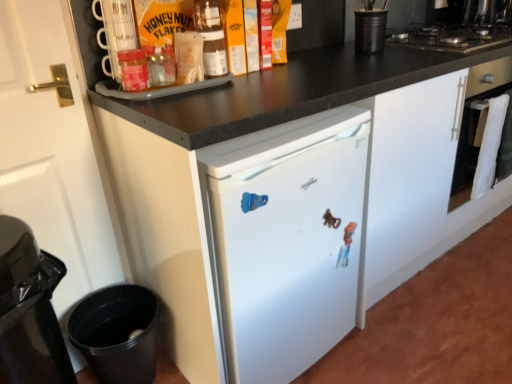
Question: Is matte glass honey jar at upper center, the second bottle positioned from the left, inside white matte door at left?

Choices:
 (A) no
 (B) yes

Answer: (A)

Question: Does white matte door at left have a greater height compared to matte glass honey jar at upper center, which is the first bottle in back-to-front order?

Choices:
 (A) no
 (B) yes

Answer: (B)

Question: From the image's perspective, would you say white matte door at left is shown under matte glass honey jar at upper center, the second bottle positioned from the left?

Choices:
 (A) yes
 (B) no

Answer: (A)

Question: From a real-world perspective, is white matte door at left under matte glass honey jar at upper center, which is counted as the second bottle, starting from the bottom?

Choices:
 (A) yes
 (B) no

Answer: (A)

Question: Is white matte door at left at the left side of matte glass honey jar at upper center, which is counted as the second bottle, starting from the bottom?

Choices:
 (A) no
 (B) yes

Answer: (B)

Question: Is the position of white matte door at left less distant than that of matte glass honey jar at upper center, which ranks as the 1th bottle in top-to-bottom order?

Choices:
 (A) no
 (B) yes

Answer: (B)

Question: From a real-world perspective, does white matte door at left sit lower than matte glass jar at upper left, which is the 2th bottle in top-to-bottom order?

Choices:
 (A) no
 (B) yes

Answer: (B)

Question: Is white matte door at left surrounding matte glass jar at upper left, placed as the 1th bottle when sorted from front to back?

Choices:
 (A) yes
 (B) no

Answer: (B)

Question: Does white matte door at left have a larger size compared to matte glass jar at upper left, which is the 2th bottle in top-to-bottom order?

Choices:
 (A) yes
 (B) no

Answer: (A)

Question: Is white matte door at left far away from matte glass jar at upper left, positioned as the 1th bottle in bottom-to-top order?

Choices:
 (A) yes
 (B) no

Answer: (B)

Question: Is the position of white matte door at left less distant than that of matte glass jar at upper left, the first bottle positioned from the left?

Choices:
 (A) yes
 (B) no

Answer: (A)

Question: Can you confirm if white matte door at left is shorter than matte glass jar at upper left, the first bottle positioned from the left?

Choices:
 (A) no
 (B) yes

Answer: (A)

Question: Does black matte gas stove at upper right contain plastic toy at center?

Choices:
 (A) yes
 (B) no

Answer: (B)